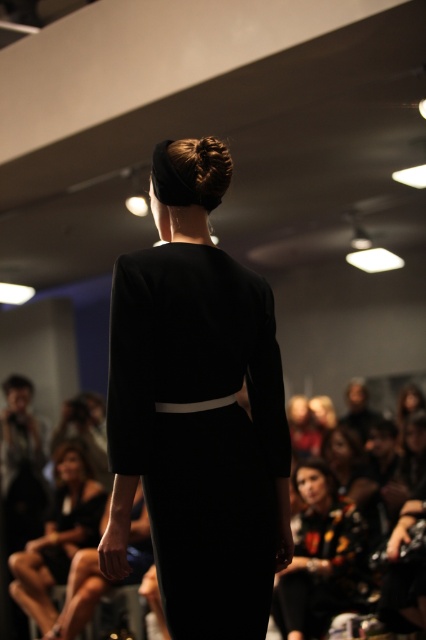
Question: Which of the following is the closest to the observer?

Choices:
 (A) (233, 307)
 (B) (210, 136)
 (C) (325, 577)
 (D) (88, 522)

Answer: (A)

Question: Which point appears closest to the camera in this image?

Choices:
 (A) (157, 275)
 (B) (319, 596)

Answer: (A)

Question: Can you confirm if black satin dress at center is positioned above dark brown hair at center?

Choices:
 (A) no
 (B) yes

Answer: (A)

Question: Does black satin dress at center have a lesser width compared to dark brown hair at center?

Choices:
 (A) yes
 (B) no

Answer: (B)

Question: Is black satin dress at center bigger than matte black dress at center?

Choices:
 (A) yes
 (B) no

Answer: (B)

Question: Which point appears closest to the camera in this image?

Choices:
 (A) (146, 273)
 (B) (212, 196)

Answer: (A)